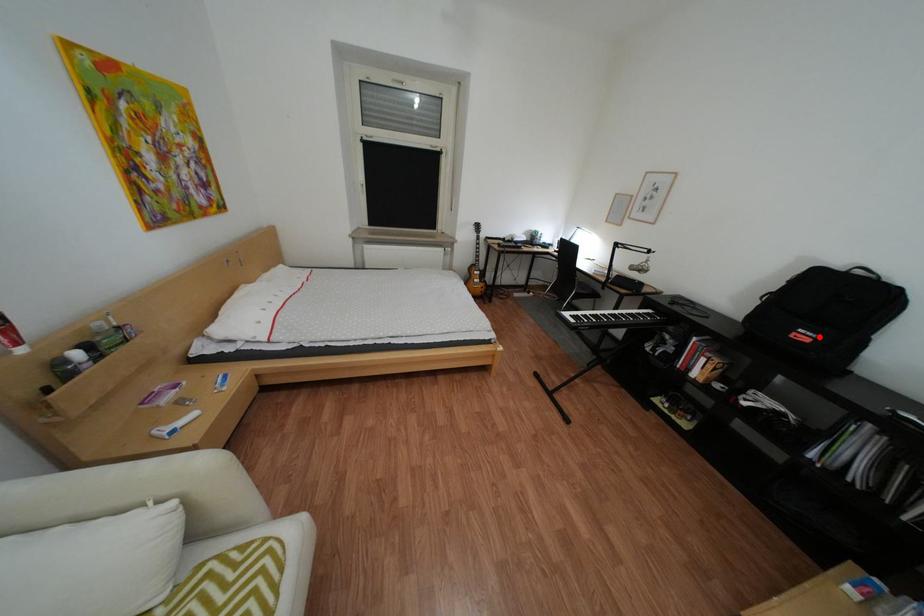
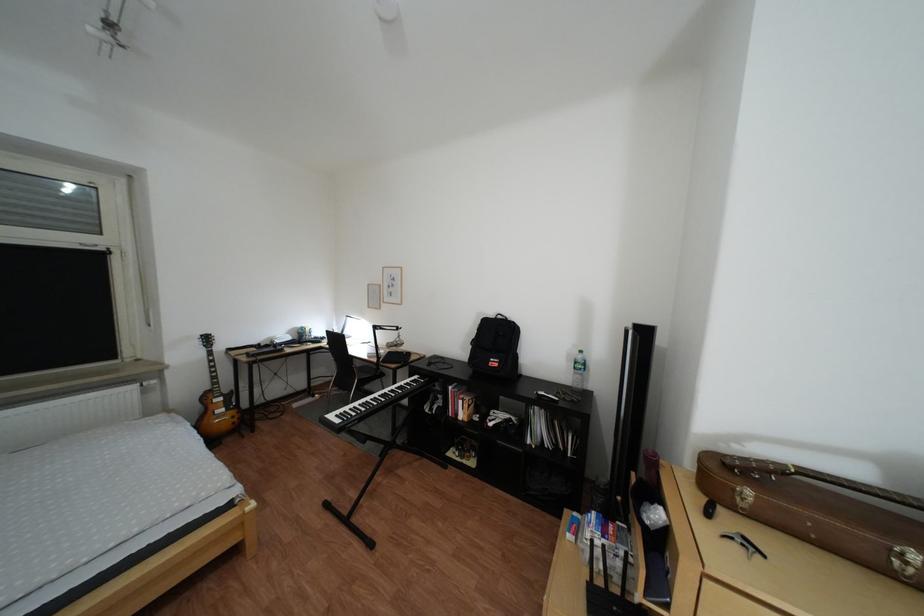
The point at the highlighted location is marked in the first image. Where is the corresponding point in the second image?

(509, 363)